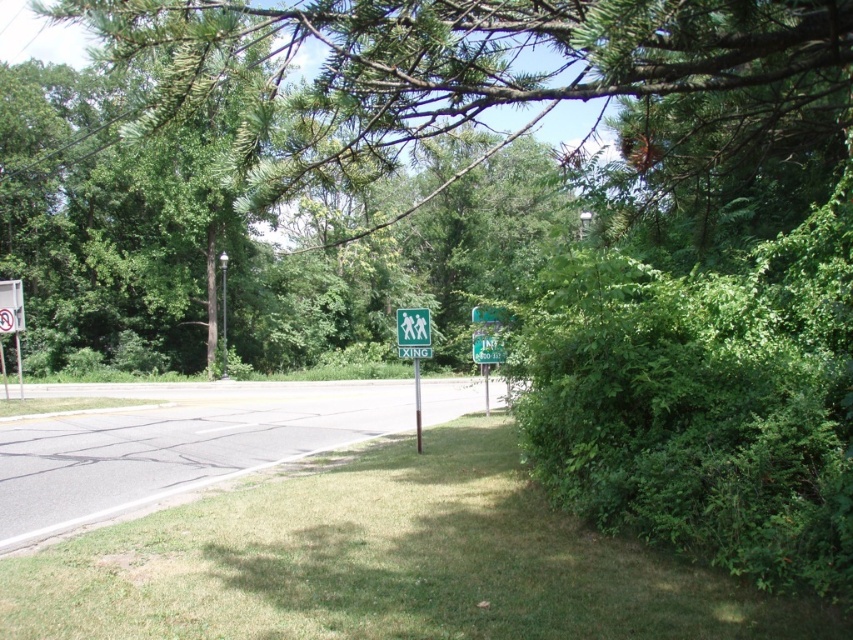
Based on the photo, you are a delivery person who needs to place a new brown wooden pole at center in the exact position of the existing green plastic pedestrian crossing sign at center. However, you notice that the current pole is shorter than the sign. Will the new pole, which is the same height as the existing one, block the view of the sign when placed there?

The green plastic pedestrian crossing sign at center is taller than the brown wooden pole at center. Since the new pole will be the same height as the existing one, it would still be shorter than the sign. Therefore, the pole will not block the view of the sign completely, but part of the sign might be obscured depending on their exact positions.

You are a gardener who needs to mow the lawn. You see the green grass at lower center and the green leafy tree at center. Which area should you focus on first if you want to mow the grass closest to you?

The green grass at lower center should be focused on first since it is closer to you than the green leafy tree at center.

You are a pedestrian trying to cross the road. You see the green plastic pedestrian crossing sign at center and the brown wooden pole at center. Which object is closer to you?

The green plastic pedestrian crossing sign at center is closer to you because it is in front of the brown wooden pole at center.